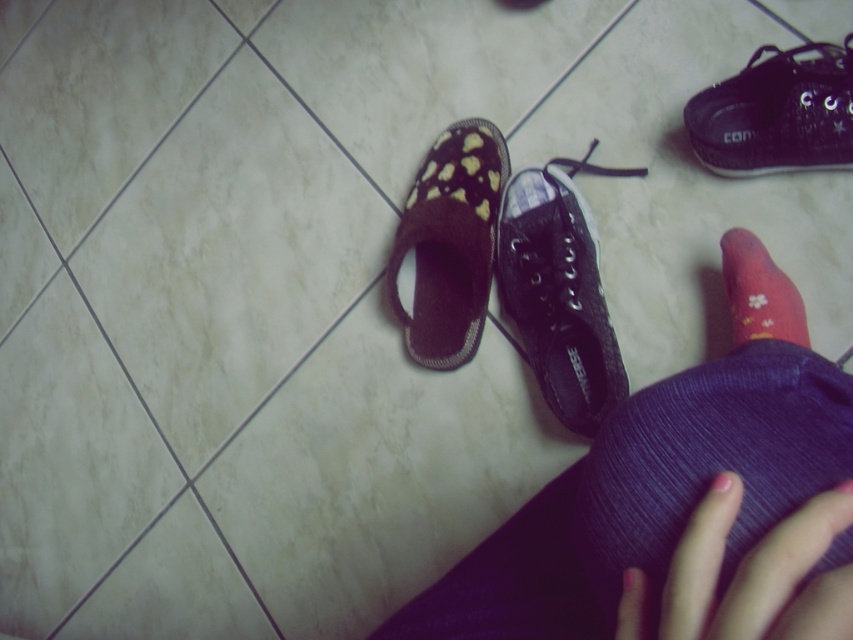
You are standing at the center of the tiled floor and want to place a new decorative item exactly at the point marked by coordinates point (450, 243). Which object from the scene is located at this position?

The point (450, 243) marks the brown fuzzy slipper at center left.

You are a photographer trying to capture a close shot of the purple fabric pants at center and the black canvas shoe at center. Since you want to focus on both items equally, which one should you adjust the camera focus on first, considering their sizes?

The purple fabric pants at center is much taller than the black canvas shoe at center, so you should focus on the purple fabric pants at center first to ensure it fills the frame appropriately before adjusting for the smaller black canvas shoe at center.